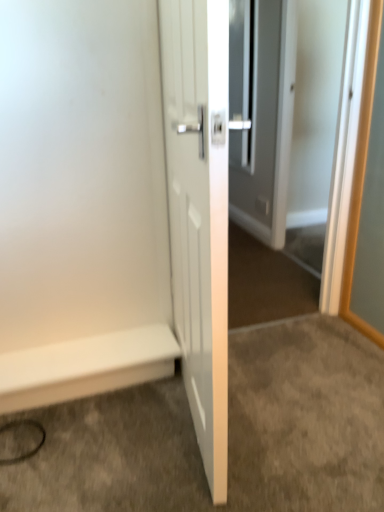
Question: Considering the relative sizes of white glossy door at center and white smooth baseboard at lower left in the image provided, is white glossy door at center smaller than white smooth baseboard at lower left?

Choices:
 (A) yes
 (B) no

Answer: (B)

Question: Does white glossy door at center have a larger size compared to white smooth baseboard at lower left?

Choices:
 (A) yes
 (B) no

Answer: (A)

Question: Can you confirm if white glossy door at center is taller than white smooth baseboard at lower left?

Choices:
 (A) no
 (B) yes

Answer: (B)

Question: From a real-world perspective, is white glossy door at center physically below white smooth baseboard at lower left?

Choices:
 (A) no
 (B) yes

Answer: (A)

Question: Is white glossy door at center completely or partially outside of white smooth baseboard at lower left?

Choices:
 (A) yes
 (B) no

Answer: (A)

Question: Does white glossy door at center lie behind white smooth baseboard at lower left?

Choices:
 (A) no
 (B) yes

Answer: (A)

Question: Considering the relative positions of white smooth baseboard at lower left and white glossy door at center in the image provided, is white smooth baseboard at lower left to the right of white glossy door at center from the viewer's perspective?

Choices:
 (A) no
 (B) yes

Answer: (A)

Question: Is white smooth baseboard at lower left positioned with its back to white glossy door at center?

Choices:
 (A) no
 (B) yes

Answer: (A)

Question: Is white smooth baseboard at lower left not within white glossy door at center?

Choices:
 (A) yes
 (B) no

Answer: (A)

Question: Would you consider white smooth baseboard at lower left to be distant from white glossy door at center?

Choices:
 (A) yes
 (B) no

Answer: (A)

Question: Is white smooth baseboard at lower left to the left of white glossy door at center from the viewer's perspective?

Choices:
 (A) yes
 (B) no

Answer: (A)

Question: From the image's perspective, is white smooth baseboard at lower left on top of white glossy door at center?

Choices:
 (A) no
 (B) yes

Answer: (A)

Question: Considering the relative positions of white smooth baseboard at lower left and white glossy door at center in the image provided, is white smooth baseboard at lower left behind white glossy door at center?

Choices:
 (A) no
 (B) yes

Answer: (B)